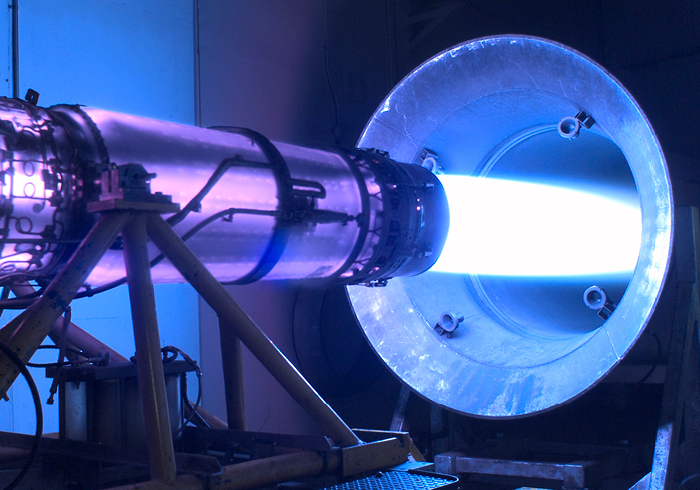
This screenshot has width=700, height=490. What are the coordinates of `wall of chamber` in the screenshot? It's located at (292, 105).